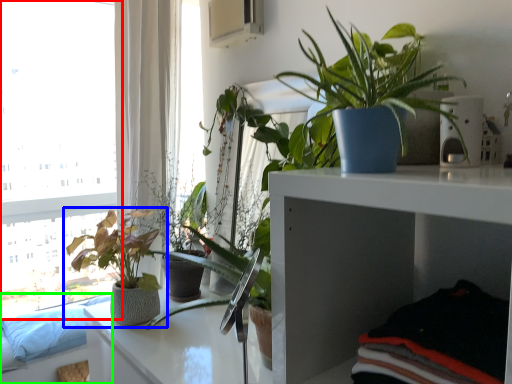
Question: Based on their relative distances, which object is farther from window (highlighted by a red box)? Choose from houseplant (highlighted by a blue box) and couch (highlighted by a green box).

Choices:
 (A) houseplant
 (B) couch

Answer: (A)